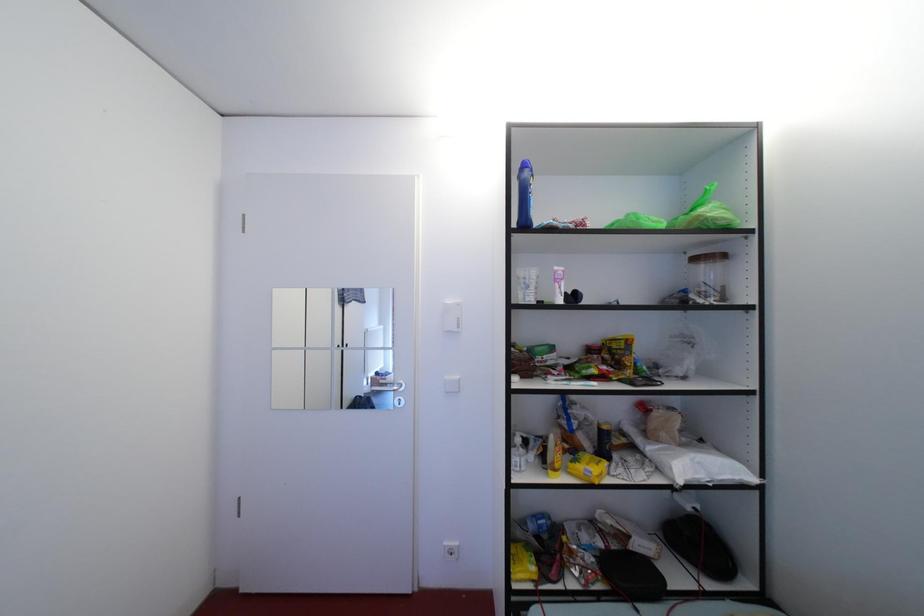
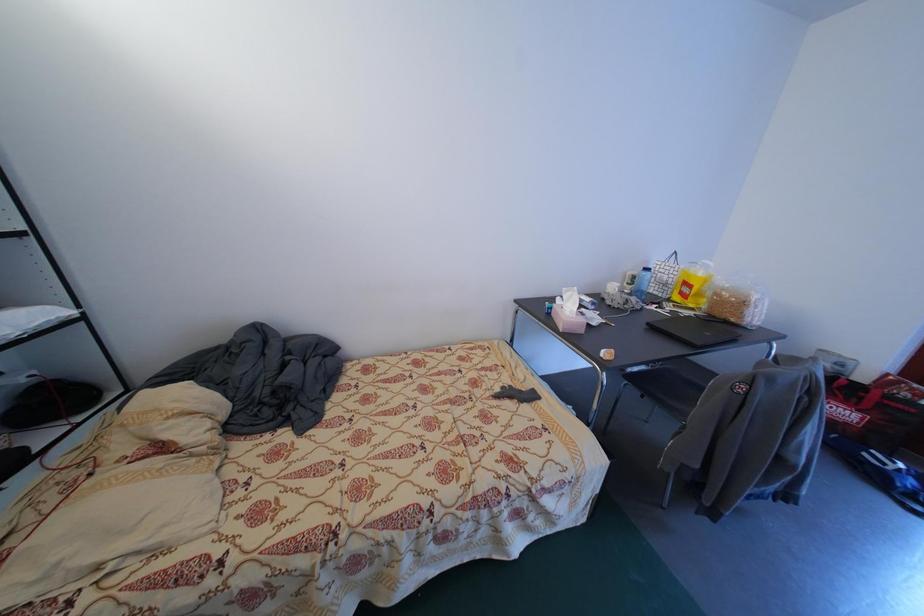
First-person continuous shooting, in which direction is the camera rotating?

The camera's rotation is toward right-down.